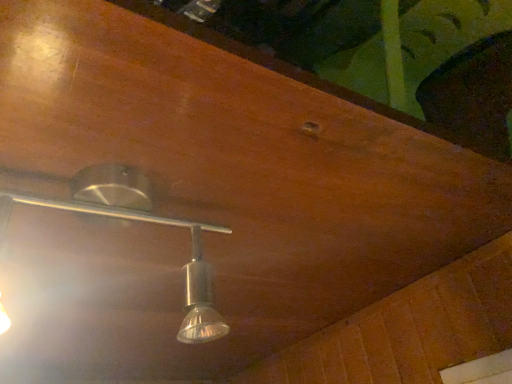
The width and height of the screenshot is (512, 384). Describe the element at coordinates (138, 221) in the screenshot. I see `satin silver spotlight at upper left` at that location.

What is the approximate width of satin silver spotlight at upper left?

It is 8.70 centimeters.

Identify the location of satin silver spotlight at upper left. This screenshot has width=512, height=384. (138, 221).

Locate an element on the screen. This screenshot has height=384, width=512. satin silver spotlight at upper left is located at coordinates (138, 221).